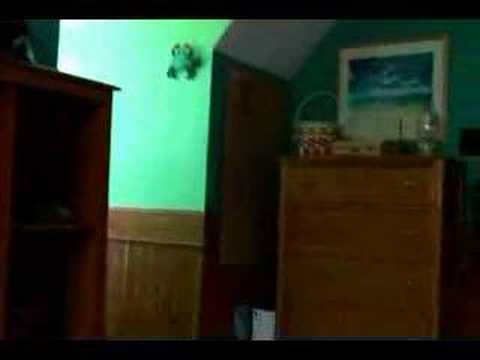
Locate an element on the screen. dresser is located at coordinates (384, 191).